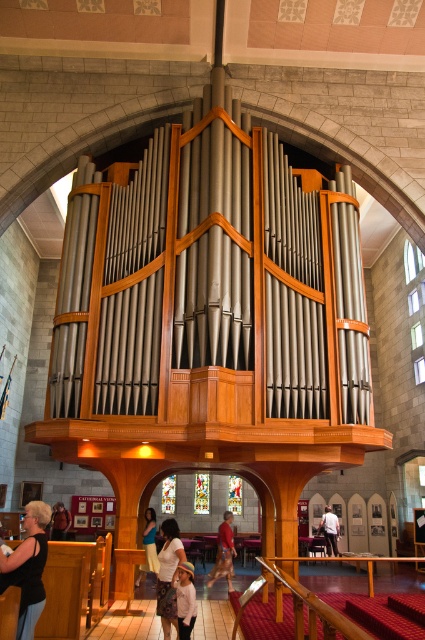
Who is more distant from viewer, (192, 620) or (68, 522)?

The point (68, 522) is more distant.

This screenshot has width=425, height=640. What are the coordinates of `white cotton shirt at lower center` in the screenshot? It's located at (184, 598).

Is red shirt at center further to the viewer compared to white cotton shirt at center?

No.

Looking at this image, does red shirt at center have a smaller size compared to white cotton shirt at center?

Actually, red shirt at center might be larger than white cotton shirt at center.

Find the location of `red shirt at center`. red shirt at center is located at coordinates (223, 552).

Image resolution: width=425 pixels, height=640 pixels. Identify the location of red shirt at center. (223, 552).

Which of these two, matte black shirt at lower left or white cotton shirt at center, stands shorter?

With less height is white cotton shirt at center.

Between point (36, 588) and point (326, 541), which one is positioned behind?

Point (326, 541)

Is point (2, 580) more distant than point (336, 536)?

No, it is in front of (336, 536).

Find the location of a particular element. matte black shirt at lower left is located at coordinates (28, 566).